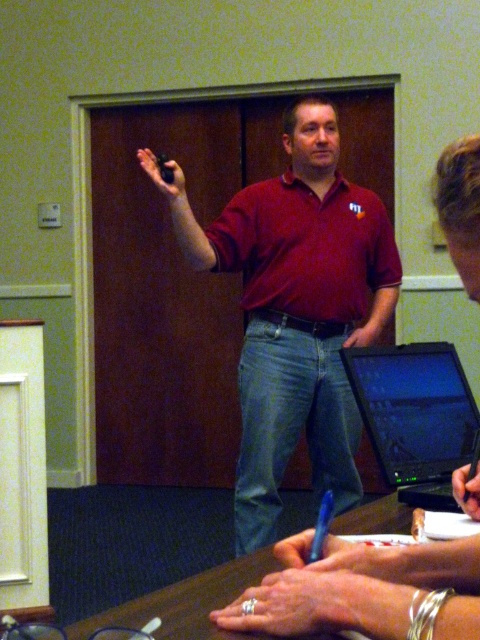
You are a participant in the meeting and want to place your notebook on the table. Where should you place it so that it doesn not block the black glossy laptop at center?

Place the notebook away from the coordinates point [415,417] where the black glossy laptop at center is located to avoid blocking it.

You are a person trying to reach the brown wooden table at lower center from where the matte red shirt at center is standing. Can you comfortably reach the table without moving your feet?

The distance between the matte red shirt at center and the brown wooden table at lower center is 3.70 feet. Since the average comfortable reaching distance without moving feet is about 2.5 feet, you cannot comfortably reach the table without moving your feet.